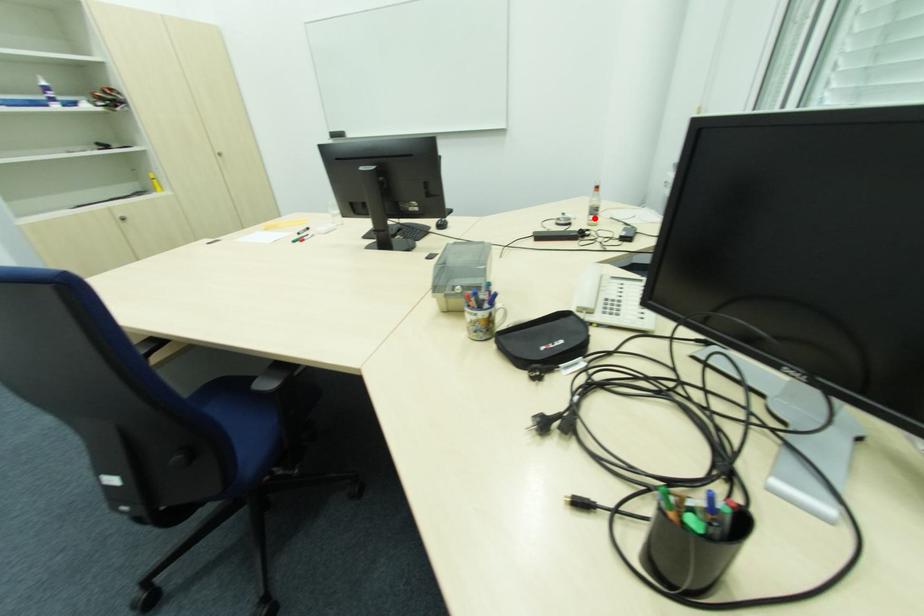
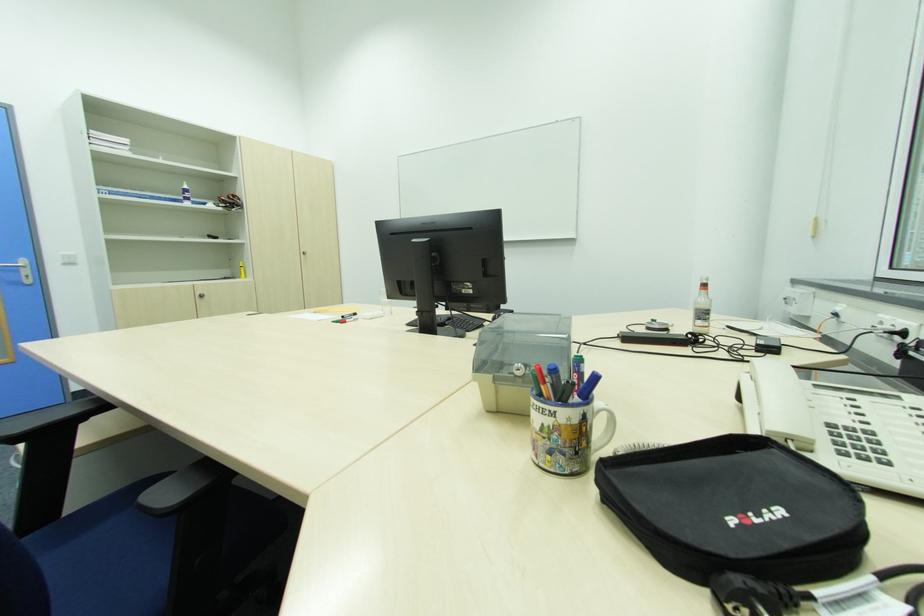
In the second image, find the point that corresponds to the highlighted location in the first image.

(702, 323)